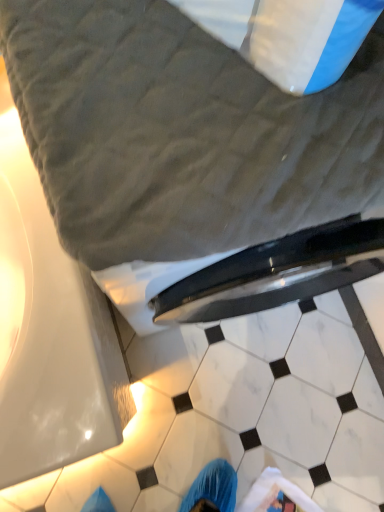
How much space does white marble tile at lower center, acting as the 1th tile starting from the back, occupy vertically?

0.53 inches.

Measure the distance between point (285, 475) and camera.

Point (285, 475) and camera are 1.12 meters apart.

What do you see at coordinates (181, 137) in the screenshot?
I see `gray quilted bed at upper center` at bounding box center [181, 137].

Where is `white marble tile at lower center, which appears as the 2th tile when viewed from the front`? The width and height of the screenshot is (384, 512). white marble tile at lower center, which appears as the 2th tile when viewed from the front is located at coordinates (265, 467).

Is gray quilted bed at upper center not inside white marble tile at lower center, acting as the 1th tile starting from the back?

Yes, gray quilted bed at upper center is not within white marble tile at lower center, acting as the 1th tile starting from the back.

Could you tell me if gray quilted bed at upper center is facing white marble tile at lower center, which appears as the 2th tile when viewed from the front?

No, gray quilted bed at upper center does not turn towards white marble tile at lower center, which appears as the 2th tile when viewed from the front.

Between gray quilted bed at upper center and white marble tile at lower center, acting as the 1th tile starting from the back, which one is positioned in front?

gray quilted bed at upper center.

Does gray quilted bed at upper center have a greater width compared to white marble tile at lower center, which appears as the 2th tile when viewed from the front?

Indeed, gray quilted bed at upper center has a greater width compared to white marble tile at lower center, which appears as the 2th tile when viewed from the front.

From the image's perspective, is gray quilted bed at upper center under white marble tile at center, which ranks as the 2th tile in back-to-front order?

Incorrect, from the image's perspective, gray quilted bed at upper center is higher than white marble tile at center, which ranks as the 2th tile in back-to-front order.

Is gray quilted bed at upper center looking in the opposite direction of white marble tile at center, which ranks as the 2th tile in back-to-front order?

gray quilted bed at upper center does not have its back to white marble tile at center, which ranks as the 2th tile in back-to-front order.

Is gray quilted bed at upper center directly adjacent to white marble tile at center, which ranks as the 2th tile in back-to-front order?

No, gray quilted bed at upper center is not with white marble tile at center, which ranks as the 2th tile in back-to-front order.

Based on their sizes in the image, would you say gray quilted bed at upper center is bigger or smaller than white marble tile at center, which ranks as the 2th tile in back-to-front order?

In the image, gray quilted bed at upper center appears to be smaller than white marble tile at center, which ranks as the 2th tile in back-to-front order.

Is point (230, 441) more distant than point (291, 475)?

That is True.

Does white marble tile at center, which ranks as the 2th tile in back-to-front order, appear on the right side of white marble tile at lower center, which appears as the 2th tile when viewed from the front?

In fact, white marble tile at center, which ranks as the 2th tile in back-to-front order, is to the left of white marble tile at lower center, which appears as the 2th tile when viewed from the front.

Where is `tile beneath the white marble tile at lower center, acting as the 1th tile starting from the back (from a real-world perspective)`? This screenshot has width=384, height=512. tile beneath the white marble tile at lower center, acting as the 1th tile starting from the back (from a real-world perspective) is located at coordinates (245, 408).

Can you confirm if white marble tile at center, acting as the first tile starting from the front, is bigger than white marble tile at lower center, which appears as the 2th tile when viewed from the front?

Indeed, white marble tile at center, acting as the first tile starting from the front, has a larger size compared to white marble tile at lower center, which appears as the 2th tile when viewed from the front.

How different are the orientations of white marble tile at lower center, which appears as the 2th tile when viewed from the front, and white marble tile at center, acting as the first tile starting from the front, in degrees?

61.5 degrees.

Considering the relative positions of white marble tile at lower center, acting as the 1th tile starting from the back, and white marble tile at center, which ranks as the 2th tile in back-to-front order, in the image provided, is white marble tile at lower center, acting as the 1th tile starting from the back, to the left of white marble tile at center, which ranks as the 2th tile in back-to-front order, from the viewer's perspective?

No, white marble tile at lower center, acting as the 1th tile starting from the back, is not to the left of white marble tile at center, which ranks as the 2th tile in back-to-front order.

From a real-world perspective, which object stands above the other?

white marble tile at lower center, which appears as the 2th tile when viewed from the front, is physically above.

Can we say white marble tile at center, acting as the first tile starting from the front, lies outside gray quilted bed at upper center?

Absolutely, white marble tile at center, acting as the first tile starting from the front, is external to gray quilted bed at upper center.

Which point is more distant from viewer, [381,300] or [130,174]?

The point [381,300] is farther from the camera.

Considering the relative positions of white marble tile at center, which ranks as the 2th tile in back-to-front order, and gray quilted bed at upper center in the image provided, is white marble tile at center, which ranks as the 2th tile in back-to-front order, to the left of gray quilted bed at upper center from the viewer's perspective?

Yes.

Which object is further away from the camera taking this photo, white marble tile at lower center, acting as the 1th tile starting from the back, or gray quilted bed at upper center?

white marble tile at lower center, acting as the 1th tile starting from the back, is behind.

Is white marble tile at lower center, which appears as the 2th tile when viewed from the front, positioned far away from gray quilted bed at upper center?

Actually, white marble tile at lower center, which appears as the 2th tile when viewed from the front, and gray quilted bed at upper center are a little close together.

This screenshot has height=512, width=384. What are the coordinates of `bed above the white marble tile at lower center, acting as the 1th tile starting from the back (from the image's perspective)` in the screenshot? It's located at (181, 137).

Considering the sizes of objects white marble tile at lower center, which appears as the 2th tile when viewed from the front, and gray quilted bed at upper center in the image provided, who is shorter, white marble tile at lower center, which appears as the 2th tile when viewed from the front, or gray quilted bed at upper center?

white marble tile at lower center, which appears as the 2th tile when viewed from the front.

Find the location of a particular element. bed above the white marble tile at lower center, which appears as the 2th tile when viewed from the front (from a real-world perspective) is located at coordinates (181, 137).

Find the location of a particular element. the 2nd tile directly beneath the gray quilted bed at upper center (from a real-world perspective) is located at coordinates (245, 408).

Estimate the real-world distances between objects in this image. Which object is closer to white marble tile at center, acting as the first tile starting from the front, gray quilted bed at upper center or white marble tile at lower center, which appears as the 2th tile when viewed from the front?

Based on the image, white marble tile at lower center, which appears as the 2th tile when viewed from the front, appears to be nearer to white marble tile at center, acting as the first tile starting from the front.

Which object lies nearer to the anchor point white marble tile at lower center, acting as the 1th tile starting from the back, gray quilted bed at upper center or white marble tile at center, which ranks as the 2th tile in back-to-front order?

white marble tile at center, which ranks as the 2th tile in back-to-front order, lies closer to white marble tile at lower center, acting as the 1th tile starting from the back, than the other object.

From the image, which object appears to be farther from gray quilted bed at upper center, white marble tile at lower center, acting as the 1th tile starting from the back, or white marble tile at center, which ranks as the 2th tile in back-to-front order?

white marble tile at lower center, acting as the 1th tile starting from the back, is further to gray quilted bed at upper center.

Based on their spatial positions, is white marble tile at center, acting as the first tile starting from the front, or gray quilted bed at upper center closer to white marble tile at lower center, which appears as the 2th tile when viewed from the front?

Based on the image, white marble tile at center, acting as the first tile starting from the front, appears to be nearer to white marble tile at lower center, which appears as the 2th tile when viewed from the front.

Looking at the image, which one is located closer to gray quilted bed at upper center, white marble tile at center, acting as the first tile starting from the front, or white marble tile at lower center, which appears as the 2th tile when viewed from the front?

white marble tile at center, acting as the first tile starting from the front, is closer to gray quilted bed at upper center.

From the image, which object appears to be farther from white marble tile at center, which ranks as the 2th tile in back-to-front order, white marble tile at lower center, acting as the 1th tile starting from the back, or gray quilted bed at upper center?

gray quilted bed at upper center.

Where is `tile between gray quilted bed at upper center and white marble tile at lower center, acting as the 1th tile starting from the back, in the up-down direction`? The image size is (384, 512). tile between gray quilted bed at upper center and white marble tile at lower center, acting as the 1th tile starting from the back, in the up-down direction is located at coordinates (245, 408).